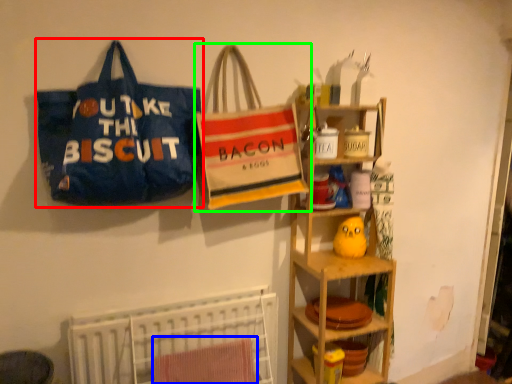
Question: Estimate the real-world distances between objects in this image. Which object is closer to handbag (highlighted by a red box), beach towel (highlighted by a blue box) or handbag (highlighted by a green box)?

Choices:
 (A) beach towel
 (B) handbag

Answer: (B)